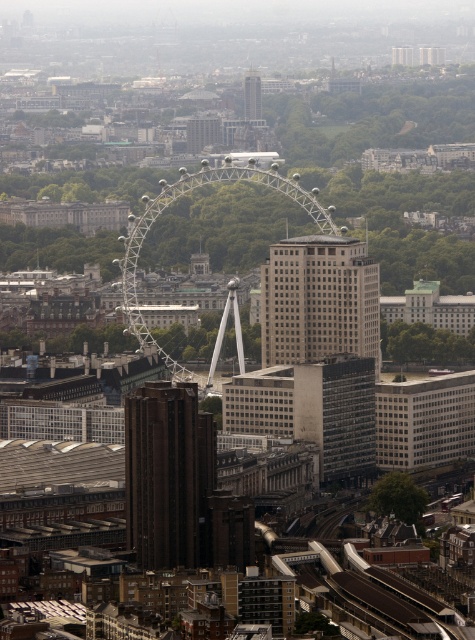
You are a drone operator flying a drone over the city. You need to capture a photo of both the shiny metallic ferris wheel at center and the matte glass tower at center. Which object should you adjust your drone to focus on first to ensure both are in frame?

You should focus on the shiny metallic ferris wheel at center first because it is closer to the viewer than the matte glass tower at center, so adjusting focus starting from the closer object ensures both are in frame.

You are a drone operator trying to navigate between two points in the city. You need to fly from point A to point B. Given the coordinates of point A as point A at (x=354, y=300) and point B at (x=249, y=77), which point is closer to the camera lens to ensure a clearer image?

Point A at (x=354, y=300) is closer to the viewer than point B at (x=249, y=77), so it will provide a clearer image.

You are a city planner analyzing the London Eye area. You observe the gray concrete skyscraper at center and the matte glass tower at center. Which structure occupies a greater area in the cityscape?

The gray concrete skyscraper at center is larger in size than the matte glass tower at center, so it occupies a greater area in the cityscape.